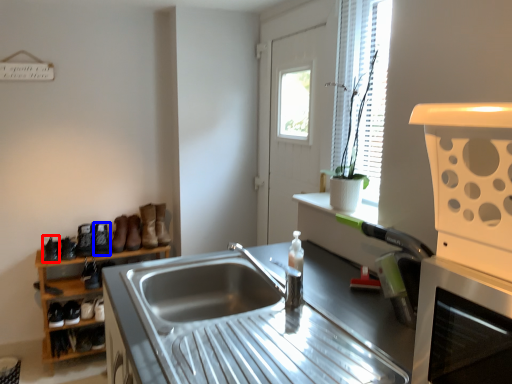
Question: Which object is further to the camera taking this photo, shoe (highlighted by a red box) or boot (highlighted by a blue box)?

Choices:
 (A) shoe
 (B) boot

Answer: (B)